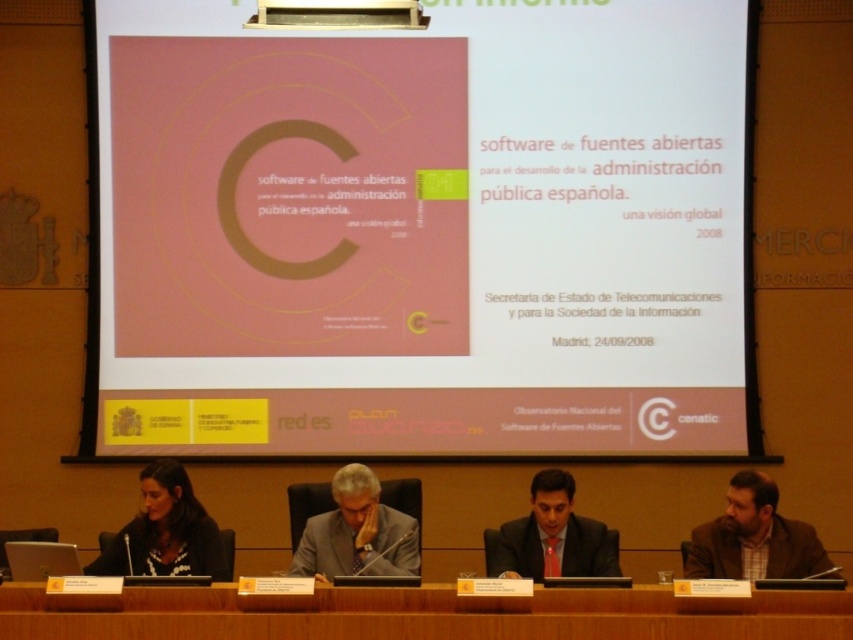
Is brown wooden table at center to the right of brown woolen jacket at lower right from the viewer's perspective?

Incorrect, brown wooden table at center is not on the right side of brown woolen jacket at lower right.

This screenshot has height=640, width=853. I want to click on brown wooden table at center, so click(x=421, y=614).

Image resolution: width=853 pixels, height=640 pixels. Find the location of `brown wooden table at center`. brown wooden table at center is located at coordinates (421, 614).

Between point (740, 556) and point (218, 577), which one is positioned in front?

Positioned in front is point (740, 556).

The image size is (853, 640). I want to click on brown woolen jacket at lower right, so click(x=753, y=538).

Can you confirm if pink matte poster at upper center is bigger than matte black suit at center?

Incorrect, pink matte poster at upper center is not larger than matte black suit at center.

Where is `pink matte poster at upper center`? This screenshot has height=640, width=853. pink matte poster at upper center is located at coordinates (422, 230).

Does point (305, 410) lie in front of point (521, 561)?

That is False.

This screenshot has width=853, height=640. What are the coordinates of `pink matte poster at upper center` in the screenshot? It's located at (422, 230).